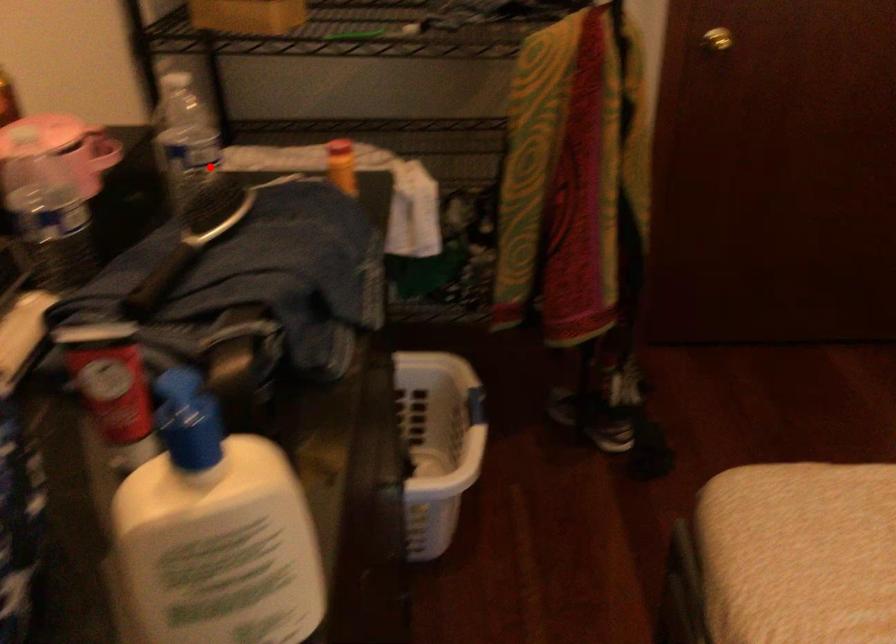
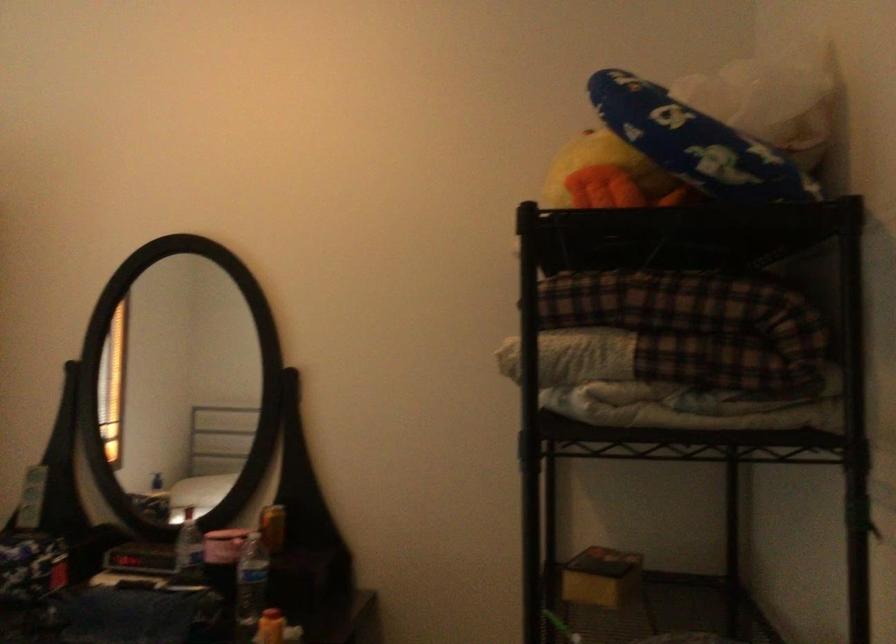
In the second image, find the point that corresponds to the highlighted location in the first image.

(250, 585)